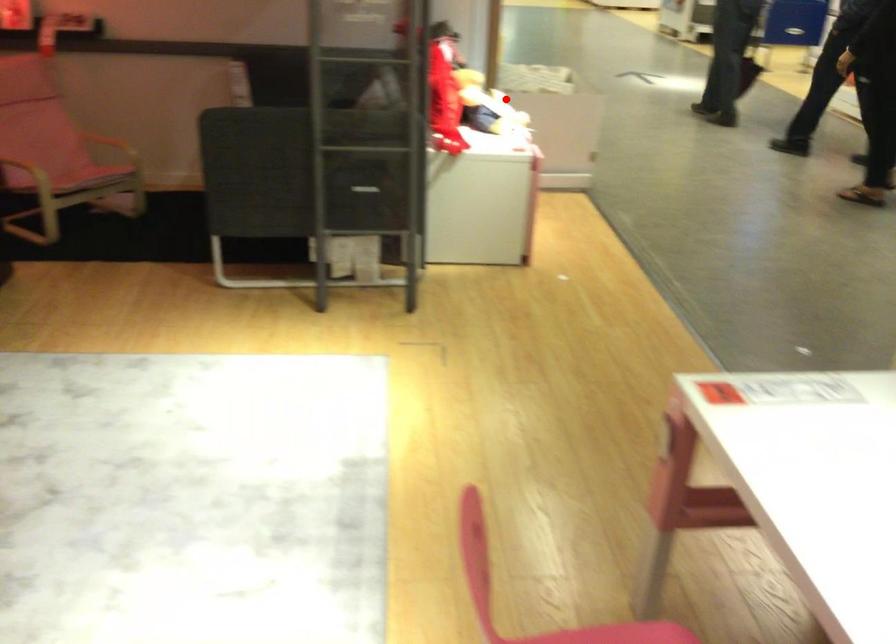
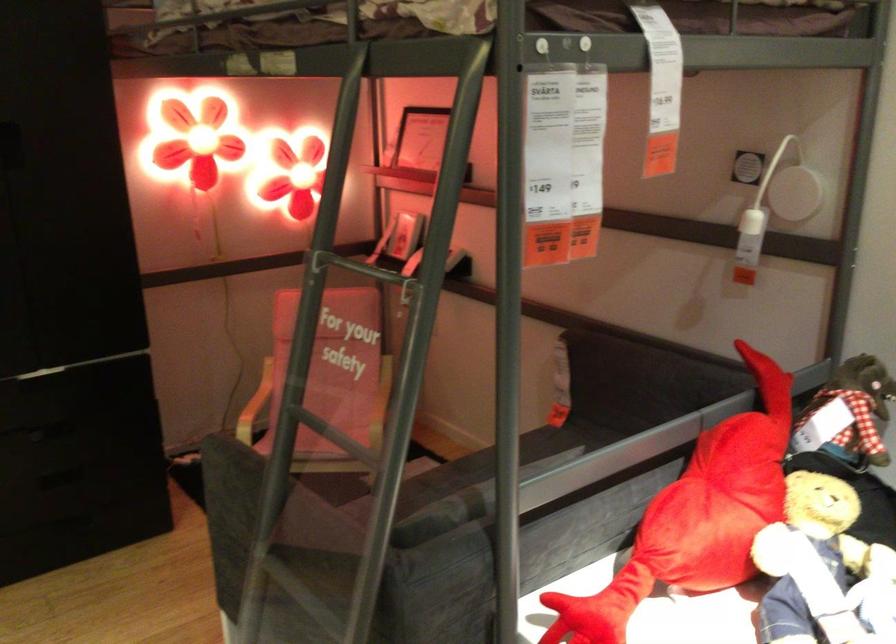
In the second image, find the point that corresponds to the highlighted location in the first image.

(823, 569)